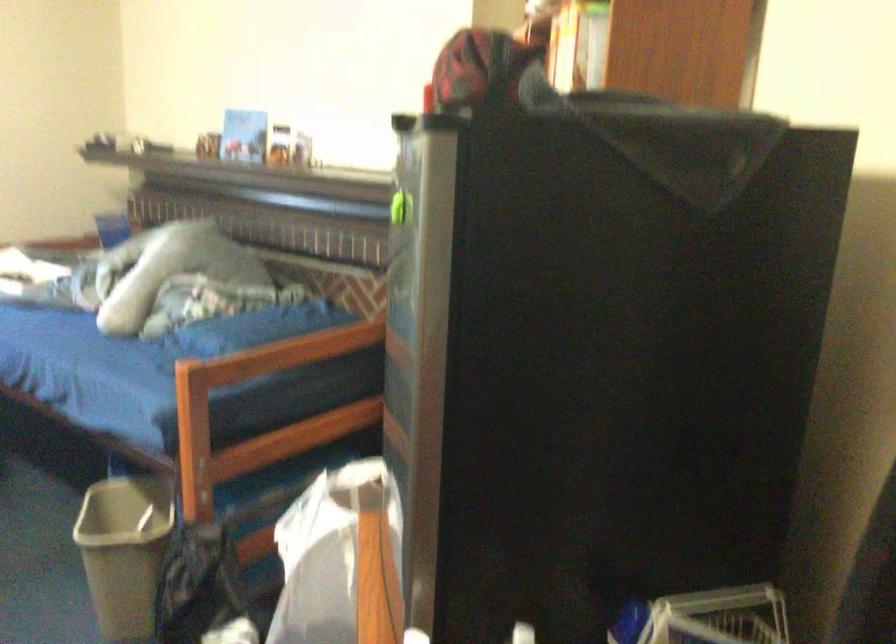
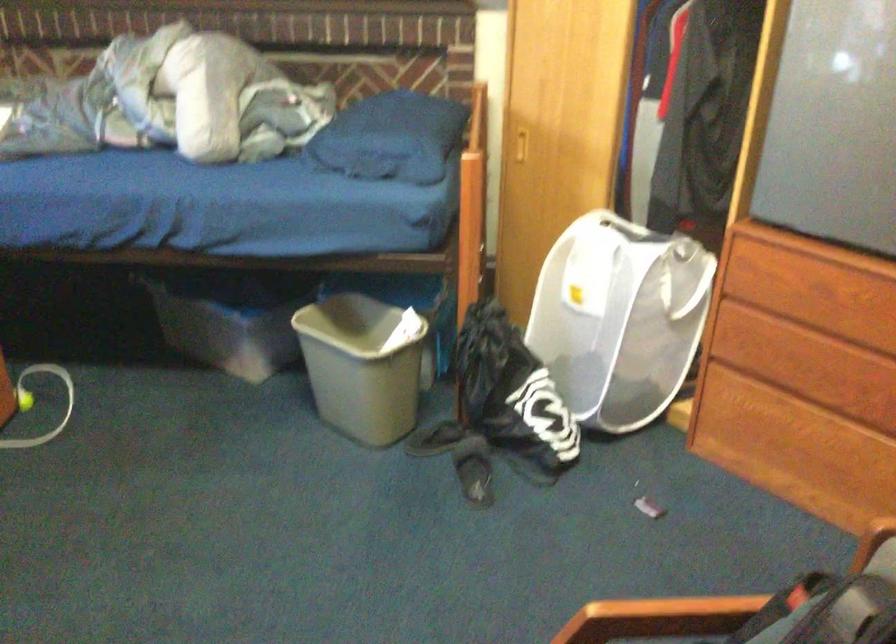
Where in the second image is the point corresponding to point (102, 544) from the first image?

(363, 365)